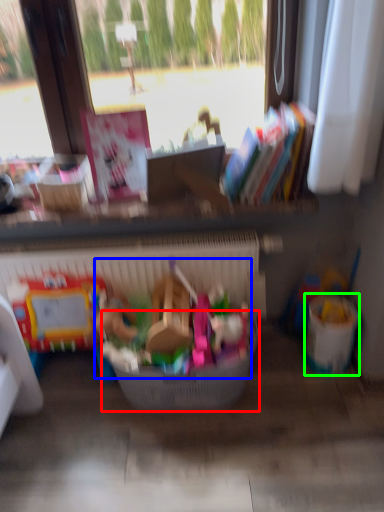
Question: Considering the real-world distances, which object is farthest from basket (highlighted by a red box)? toy (highlighted by a blue box) or recycling bin (highlighted by a green box)?

Choices:
 (A) toy
 (B) recycling bin

Answer: (B)